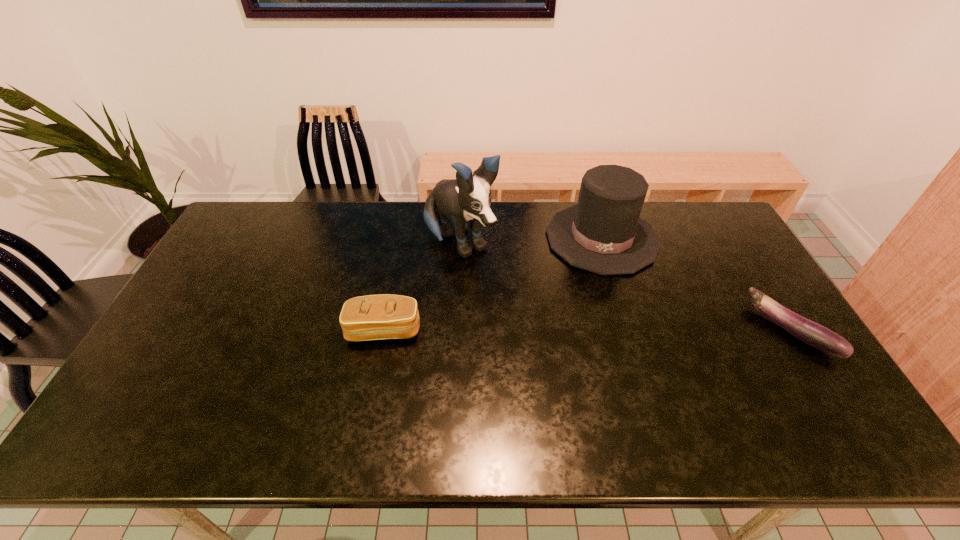
Where is `empty space between the clutch bag and the puppy`? This screenshot has width=960, height=540. empty space between the clutch bag and the puppy is located at coordinates (422, 287).

I want to click on vacant space that's between the clutch bag and the tallest object, so click(422, 287).

At what (x,y) coordinates should I click in order to perform the action: click on the third closest object to the puppy. Please return your answer as a coordinate pair (x, y). The height and width of the screenshot is (540, 960). Looking at the image, I should click on (810, 332).

Locate which object ranks third in proximity to the eggplant. Please provide its 2D coordinates. Your answer should be formatted as a tuple, i.e. [(x, y)], where the tuple contains the x and y coordinates of a point satisfying the conditions above.

[(374, 317)]

Where is `free space in the image that satisfies the following two spatial constraints: 1. on the back side of the puppy; 2. on the left side of the dress hat`? Image resolution: width=960 pixels, height=540 pixels. free space in the image that satisfies the following two spatial constraints: 1. on the back side of the puppy; 2. on the left side of the dress hat is located at coordinates (460, 238).

Locate an element on the screen. Image resolution: width=960 pixels, height=540 pixels. blank space that satisfies the following two spatial constraints: 1. on the zipper side of the third tallest object; 2. on the left side of the rightmost object is located at coordinates (384, 330).